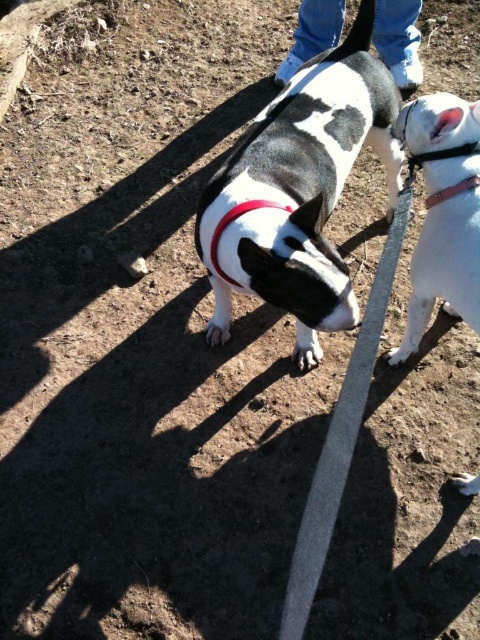
Question: Does jeans at upper center appear on the right side of red leather collar at center?

Choices:
 (A) no
 (B) yes

Answer: (B)

Question: Can you confirm if white matte dog at center is positioned above red leather collar at center?

Choices:
 (A) yes
 (B) no

Answer: (B)

Question: Is jeans at upper center to the right of red leather collar at center from the viewer's perspective?

Choices:
 (A) yes
 (B) no

Answer: (A)

Question: Which of the following is the farthest from the observer?

Choices:
 (A) (223, 220)
 (B) (402, 76)

Answer: (B)

Question: Which of these objects is positioned closest to the white matte dog at center?

Choices:
 (A) black and white fur at center
 (B) red leather collar at center
 (C) jeans at upper center

Answer: (A)

Question: Which point appears farthest from the camera in this image?

Choices:
 (A) (472, 276)
 (B) (283, 198)

Answer: (B)